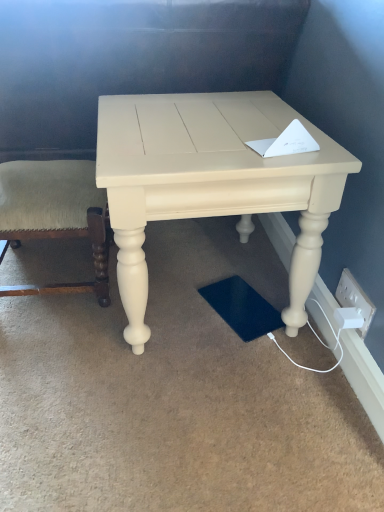
Locate an element on the screen. Image resolution: width=384 pixels, height=512 pixels. vacant space situated above green fabric cushion at left (from a real-world perspective) is located at coordinates (37, 177).